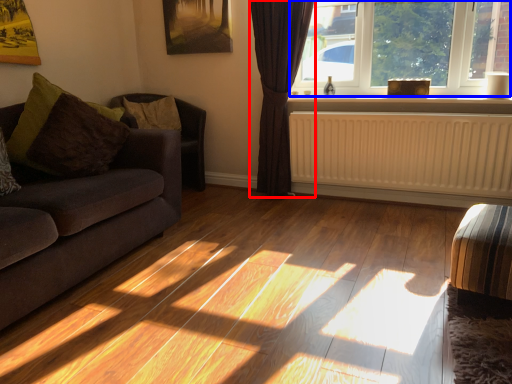
Question: Among these objects, which one is nearest to the camera, curtain (highlighted by a red box) or window (highlighted by a blue box)?

Choices:
 (A) curtain
 (B) window

Answer: (B)